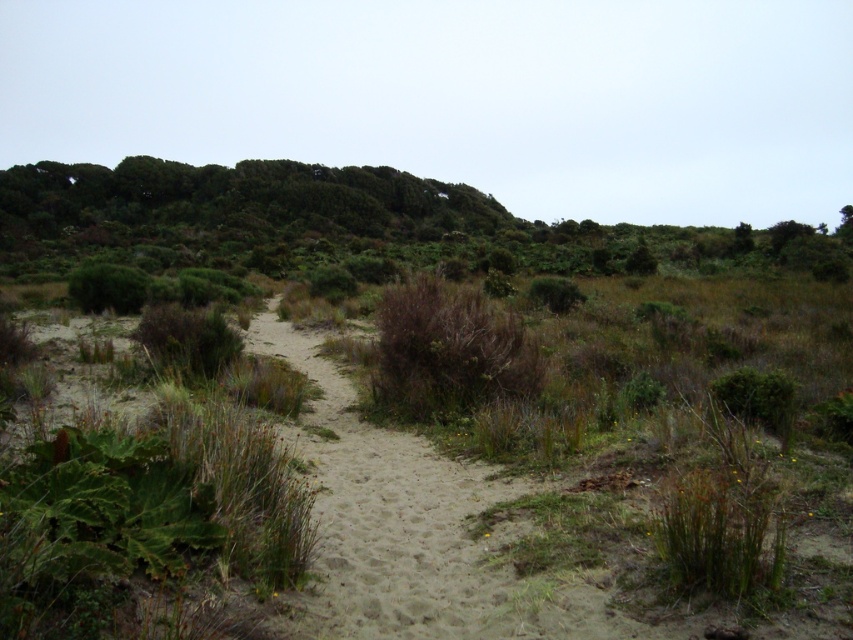
You are standing at the point marked as point (x=189, y=339) in the image. Looking around, you see a brown dry bush at lower left and a green fern at upper right. Which direction should you walk to avoid the brown dry bush at lower left?

The brown dry bush at lower left is located at point (x=189, y=339), so to avoid it, you should walk towards the green fern at upper right which is in the opposite direction.

From the picture: You are a hiker who wants to walk along the sandy path in the image. You notice the brown dry bush at lower left and the green leafy bush at lower right. Which of these bushes is closer to the left side of the path?

The brown dry bush at lower left is closer to the left side of the path because it is positioned to the left of the green leafy bush at lower right.